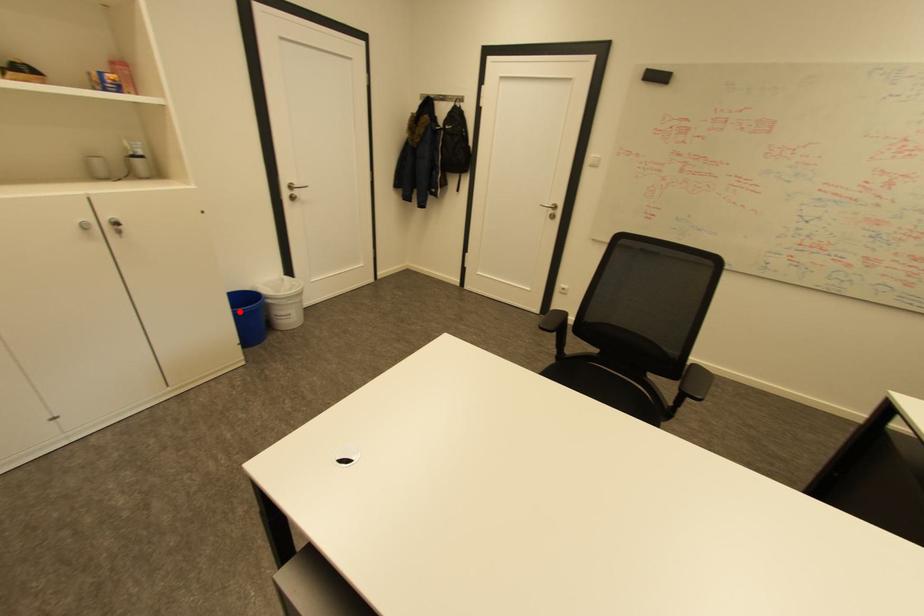
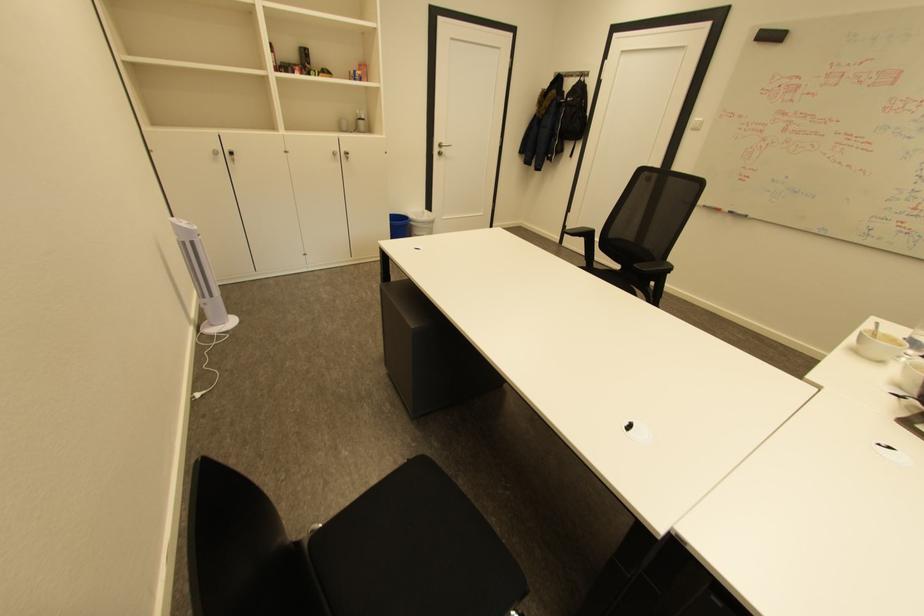
Question: I am providing you with two images of the same scene from different viewpoints. A red point is shown in image1. For the corresponding object point in image2, is it positioned nearer or farther from the camera?

Choices:
 (A) Nearer
 (B) Farther

Answer: (A)